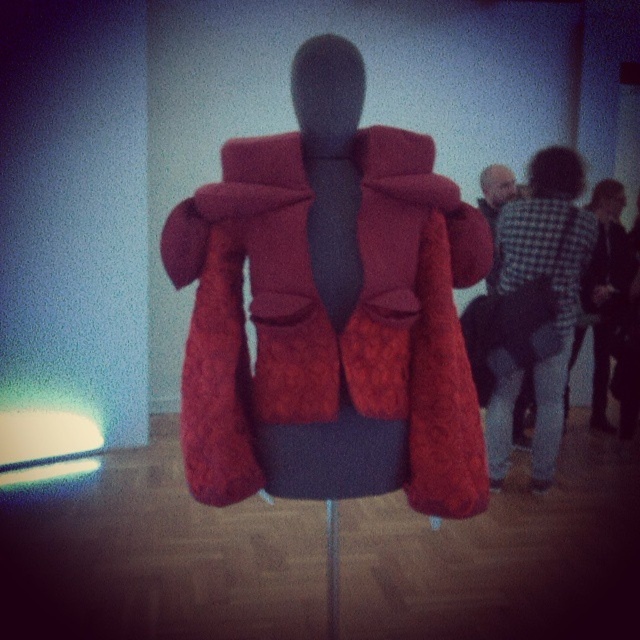
Question: Considering the relative positions of checkered fabric shirt at center and black checkered shirt at upper right in the image provided, where is checkered fabric shirt at center located with respect to black checkered shirt at upper right?

Choices:
 (A) left
 (B) right

Answer: (A)

Question: Which point is farther to the camera?

Choices:
 (A) coord(301,51)
 (B) coord(560,237)
 (C) coord(628,275)

Answer: (C)

Question: Which object appears farthest from the camera in this image?

Choices:
 (A) black checkered shirt at upper right
 (B) checkered fabric shirt at center

Answer: (A)

Question: Can you confirm if velvet red coat at center is positioned above checkered fabric shirt at center?

Choices:
 (A) yes
 (B) no

Answer: (A)

Question: Which of the following is the farthest from the observer?

Choices:
 (A) black checkered shirt at upper right
 (B) checkered fabric shirt at center
 (C) velvet red coat at center

Answer: (A)

Question: Considering the relative positions of velvet red coat at center and checkered fabric shirt at center in the image provided, where is velvet red coat at center located with respect to checkered fabric shirt at center?

Choices:
 (A) above
 (B) below

Answer: (A)